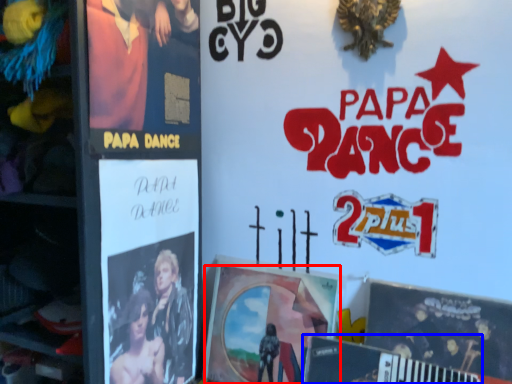
Question: Which object appears closest to the camera in this image, poster (highlighted by a red box) or magazine (highlighted by a blue box)?

Choices:
 (A) poster
 (B) magazine

Answer: (B)